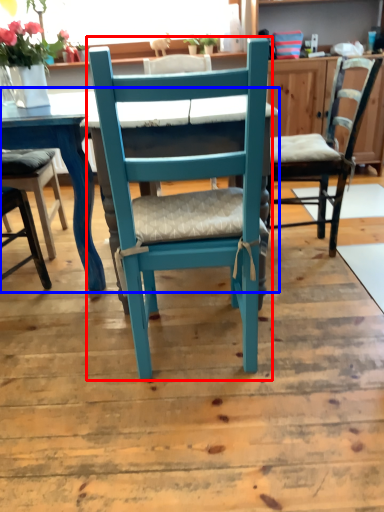
Question: Among these objects, which one is farthest to the camera, chair (highlighted by a red box) or table (highlighted by a blue box)?

Choices:
 (A) chair
 (B) table

Answer: (B)